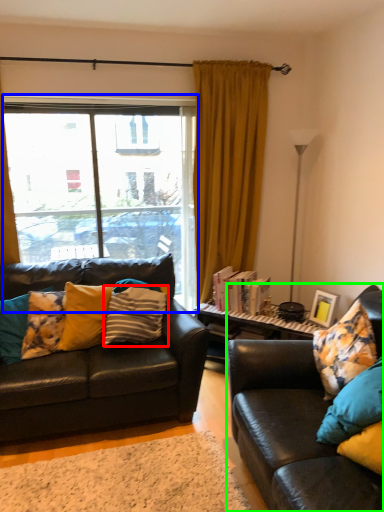
Question: Estimate the real-world distances between objects in this image. Which object is closer to pillow (highlighted by a red box), window (highlighted by a blue box) or studio couch (highlighted by a green box)?

Choices:
 (A) window
 (B) studio couch

Answer: (A)